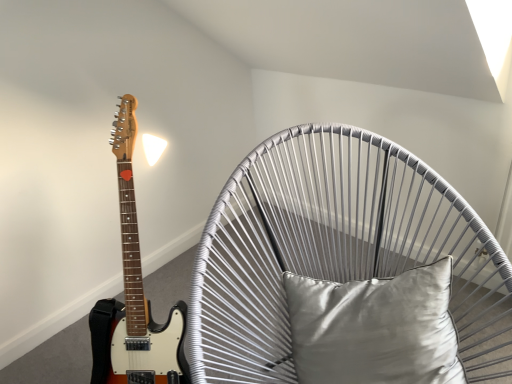
Where is `satin gray pillow at center`? This screenshot has height=384, width=512. satin gray pillow at center is located at coordinates (375, 328).

Describe the element at coordinates (375, 328) in the screenshot. I see `satin gray pillow at center` at that location.

Find the location of `metallic wire swivel chair at center`. metallic wire swivel chair at center is located at coordinates (337, 250).

Measure the distance between metallic wire swivel chair at center and camera.

The depth of metallic wire swivel chair at center is 34.84 inches.

The height and width of the screenshot is (384, 512). What do you see at coordinates (337, 250) in the screenshot?
I see `metallic wire swivel chair at center` at bounding box center [337, 250].

Locate an element on the screen. satin gray pillow at center is located at coordinates (x=375, y=328).

Does metallic wire swivel chair at center appear on the left side of satin gray pillow at center?

Yes, metallic wire swivel chair at center is to the left of satin gray pillow at center.

Is metallic wire swivel chair at center positioned in front of satin gray pillow at center?

Yes, it is.

Considering the positions of point (413, 176) and point (426, 294), is point (413, 176) closer or farther from the camera than point (426, 294)?

Point (413, 176) is farther from the camera than point (426, 294).

In the scene shown: From the image's perspective, is metallic wire swivel chair at center beneath satin gray pillow at center?

Indeed, from the image's perspective, metallic wire swivel chair at center is shown beneath satin gray pillow at center.

In the scene shown: From a real-world perspective, who is located higher, metallic wire swivel chair at center or satin gray pillow at center?

satin gray pillow at center is physically above.

Can you confirm if metallic wire swivel chair at center is wider than satin gray pillow at center?

Yes, metallic wire swivel chair at center is wider than satin gray pillow at center.

Who is shorter, metallic wire swivel chair at center or satin gray pillow at center?

With less height is satin gray pillow at center.

Considering the relative sizes of metallic wire swivel chair at center and satin gray pillow at center in the image provided, is metallic wire swivel chair at center smaller than satin gray pillow at center?

No, metallic wire swivel chair at center is not smaller than satin gray pillow at center.

Do you think metallic wire swivel chair at center is within satin gray pillow at center, or outside of it?

metallic wire swivel chair at center lies outside satin gray pillow at center.

Are metallic wire swivel chair at center and satin gray pillow at center making contact?

No, metallic wire swivel chair at center is not next to satin gray pillow at center.

Does metallic wire swivel chair at center turn towards satin gray pillow at center?

Yes, metallic wire swivel chair at center is aimed at satin gray pillow at center.

How different are the orientations of metallic wire swivel chair at center and satin gray pillow at center in degrees?

The facing directions of metallic wire swivel chair at center and satin gray pillow at center are 11.2 degrees apart.

You are a GUI agent. You are given a task and a screenshot of the screen. Output one action in this format:
    pyautogui.click(x=<x>, y=<y>)
    Task: Click on the pillow behind the metallic wire swivel chair at center
    
    Given the screenshot: What is the action you would take?
    pyautogui.click(x=375, y=328)

Considering the relative positions of satin gray pillow at center and metallic wire swivel chair at center in the image provided, is satin gray pillow at center to the left or to the right of metallic wire swivel chair at center?

satin gray pillow at center is to the right of metallic wire swivel chair at center.

Relative to metallic wire swivel chair at center, is satin gray pillow at center in front or behind?

In the image, satin gray pillow at center appears behind metallic wire swivel chair at center.

Which point is more forward, (x=319, y=282) or (x=225, y=372)?

Positioned in front is point (x=225, y=372).

From the image's perspective, which object appears higher, satin gray pillow at center or metallic wire swivel chair at center?

satin gray pillow at center.

From a real-world perspective, is satin gray pillow at center beneath metallic wire swivel chair at center?

No.

Which object is wider, satin gray pillow at center or metallic wire swivel chair at center?

metallic wire swivel chair at center is wider.

In terms of height, does satin gray pillow at center look taller or shorter compared to metallic wire swivel chair at center?

satin gray pillow at center is shorter than metallic wire swivel chair at center.

Can you confirm if satin gray pillow at center is bigger than metallic wire swivel chair at center?

No.

Would you say satin gray pillow at center contains metallic wire swivel chair at center?

Actually, metallic wire swivel chair at center is outside satin gray pillow at center.

Does satin gray pillow at center touch metallic wire swivel chair at center?

There is a gap between satin gray pillow at center and metallic wire swivel chair at center.

Based on the photo, is satin gray pillow at center facing towards metallic wire swivel chair at center?

Yes.

What's the angular difference between satin gray pillow at center and metallic wire swivel chair at center's facing directions?

They differ by 11.2 degrees in their facing directions.

Locate an element on the screen. The width and height of the screenshot is (512, 384). swivel chair that appears in front of the satin gray pillow at center is located at coordinates (337, 250).

Find the location of a particular element. Image resolution: width=512 pixels, height=384 pixels. swivel chair below the satin gray pillow at center (from the image's perspective) is located at coordinates (337, 250).

Image resolution: width=512 pixels, height=384 pixels. Identify the location of swivel chair in front of the satin gray pillow at center. [337, 250].